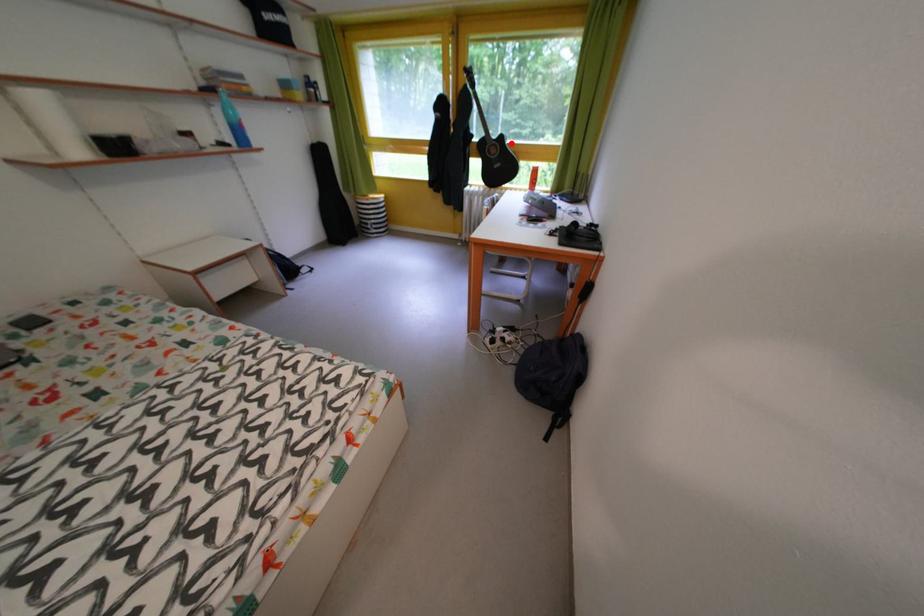
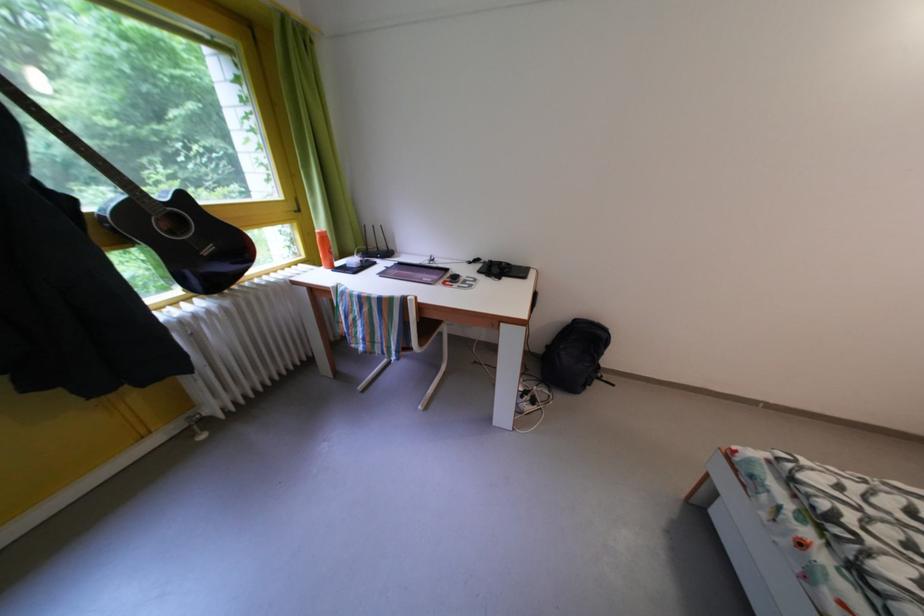
Question: I am providing you with two images of the same scene from different viewpoints. A red point is shown in image1. For the corresponding object point in image2, is it positioned nearer or farther from the camera?

Choices:
 (A) Nearer
 (B) Farther

Answer: (B)